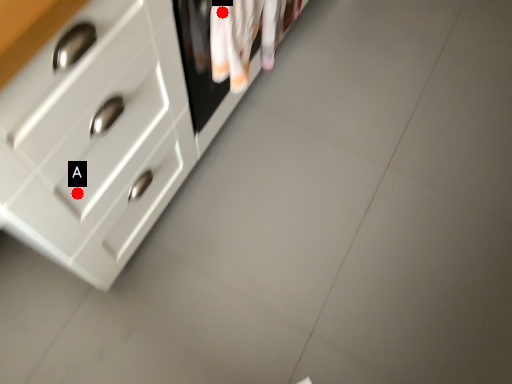
Question: Two points are circled on the image, labeled by A and B beside each circle. Which point appears closest to the camera in this image?

Choices:
 (A) A is closer
 (B) B is closer

Answer: (A)